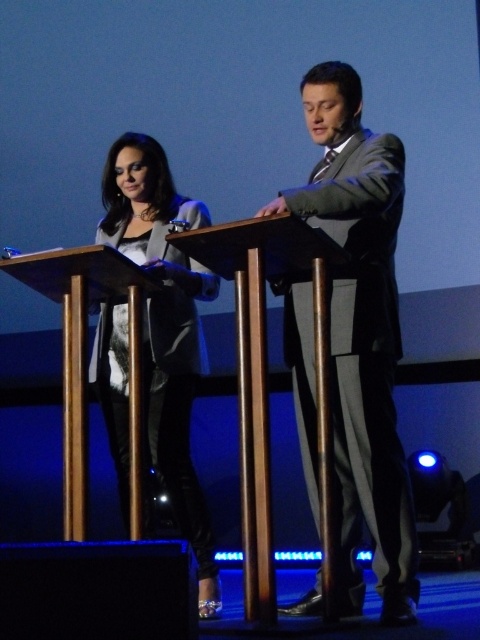
This screenshot has height=640, width=480. Find the location of `matte gray suit at center`. matte gray suit at center is located at coordinates (361, 332).

Which is behind, point (379, 589) or point (139, 241)?

Positioned behind is point (139, 241).

Identify the location of matte gray suit at center. (361, 332).